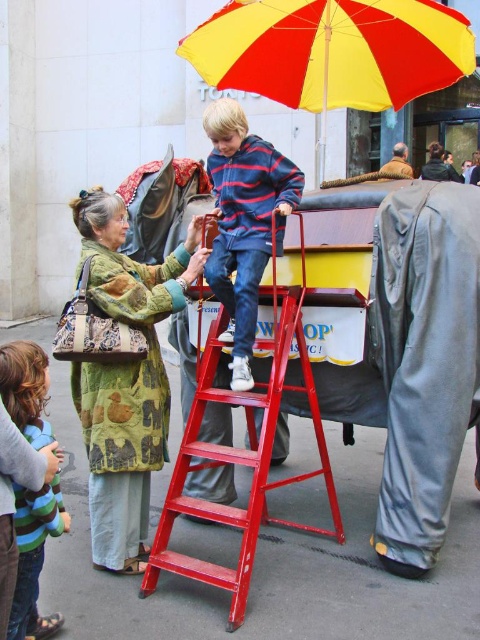
Question: Is yellow fabric umbrella at upper center bigger than metallic red ladder at center?

Choices:
 (A) no
 (B) yes

Answer: (A)

Question: Does metallic red ladder at center come in front of brown leather jacket at upper right?

Choices:
 (A) no
 (B) yes

Answer: (B)

Question: Estimate the real-world distances between objects in this image. Which object is farther from the metallic red ladder at center?

Choices:
 (A) yellow fabric umbrella at upper center
 (B) striped cotton shirt at lower left
 (C) brown leather jacket at upper right

Answer: (A)

Question: Which object is positioned farthest from the striped cotton shirt at lower left?

Choices:
 (A) green textured coat at center
 (B) brown leather jacket at upper right
 (C) striped cotton shirt at center

Answer: (B)

Question: Does yellow fabric umbrella at upper center have a lesser width compared to striped cotton shirt at lower left?

Choices:
 (A) yes
 (B) no

Answer: (B)

Question: Which point appears farthest from the camera in this image?

Choices:
 (A) (403, 173)
 (B) (289, 211)
 (C) (215, 396)

Answer: (A)